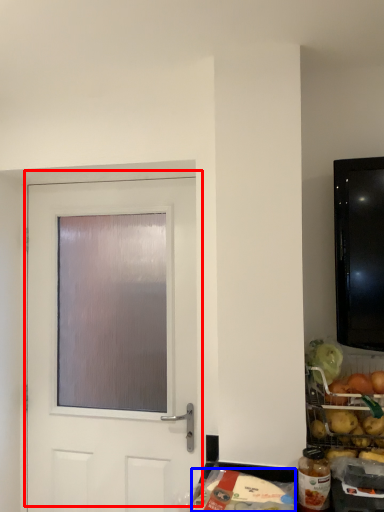
Question: Which of the following is the closest to the observer, door (highlighted by a red box) or food (highlighted by a blue box)?

Choices:
 (A) door
 (B) food

Answer: (B)